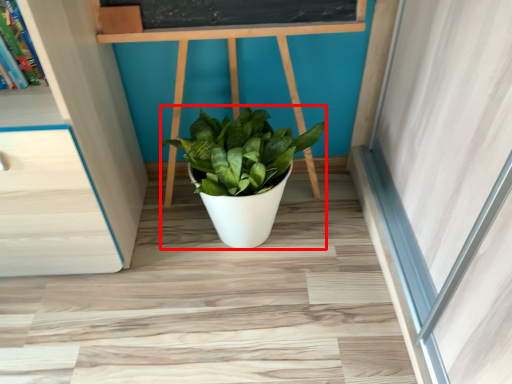
Question: Where is houseplant (annotated by the red box) located in relation to shelf in the image?

Choices:
 (A) right
 (B) left

Answer: (A)